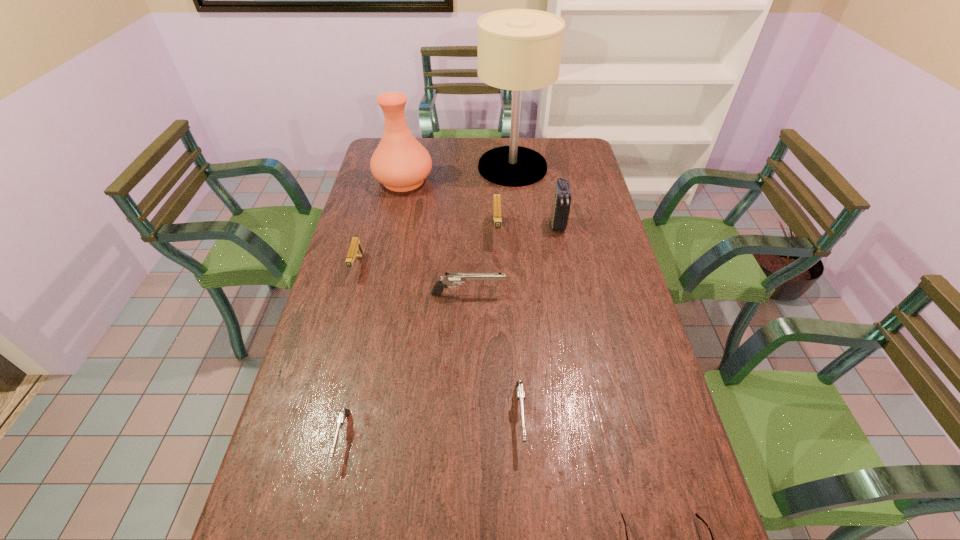
This screenshot has height=540, width=960. I want to click on table lamp, so click(x=518, y=49).

Where is `beige table lamp`? The width and height of the screenshot is (960, 540). beige table lamp is located at coordinates (518, 49).

Find the location of a particular element. This screenshot has height=540, width=960. the second tallest object is located at coordinates (401, 163).

At what (x,y) coordinates should I click in order to perform the action: click on the third tallest object. Please return your answer as a coordinate pair (x, y). Image resolution: width=960 pixels, height=540 pixels. Looking at the image, I should click on (560, 210).

Where is `the farthest pistol`? This screenshot has height=540, width=960. the farthest pistol is located at coordinates (497, 219).

I want to click on the right tan pistol, so click(497, 219).

Locate an element on the screen. the biggest silver pistol is located at coordinates (450, 278).

I want to click on the second silver pistol from left to right, so click(x=450, y=278).

Locate an element on the screen. The height and width of the screenshot is (540, 960). the fifth nearest object is located at coordinates (355, 250).

Locate an element on the screen. Image resolution: width=960 pixels, height=540 pixels. the leftmost pistol is located at coordinates (355, 250).